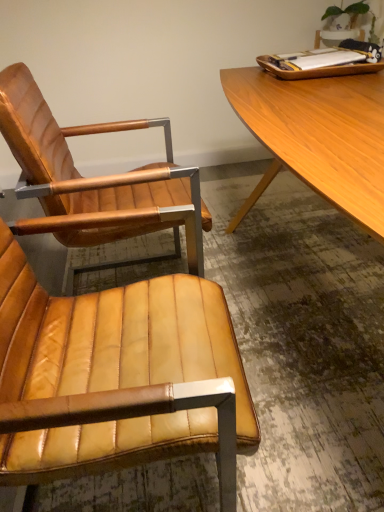
Question: Is the position of leather chair at center, which appears as the second chair when viewed from the front, more distant than that of leather chair at center, which ranks as the first chair in front-to-back order?

Choices:
 (A) yes
 (B) no

Answer: (A)

Question: Is leather chair at center, which appears as the second chair when viewed from the front, smaller than leather chair at center, which appears as the second chair when viewed from the back?

Choices:
 (A) yes
 (B) no

Answer: (B)

Question: Would you say leather chair at center, which ranks as the first chair in front-to-back order, is part of leather chair at center, which appears as the second chair when viewed from the front,'s contents?

Choices:
 (A) yes
 (B) no

Answer: (B)

Question: From the image's perspective, is leather chair at center, which appears as the second chair when viewed from the front, below leather chair at center, which appears as the second chair when viewed from the back?

Choices:
 (A) yes
 (B) no

Answer: (B)

Question: Is leather chair at center, the first chair from the back, outside leather chair at center, which appears as the second chair when viewed from the back?

Choices:
 (A) no
 (B) yes

Answer: (B)

Question: From the image's perspective, is leather chair at center, the first chair from the back, located above leather chair at center, which ranks as the first chair in front-to-back order?

Choices:
 (A) yes
 (B) no

Answer: (A)

Question: From a real-world perspective, is leather chair at center, which appears as the second chair when viewed from the back, located higher than leather chair at center, which appears as the second chair when viewed from the front?

Choices:
 (A) yes
 (B) no

Answer: (B)

Question: From a real-world perspective, is leather chair at center, which appears as the second chair when viewed from the back, positioned under leather chair at center, which appears as the second chair when viewed from the front, based on gravity?

Choices:
 (A) yes
 (B) no

Answer: (A)

Question: Would you say leather chair at center, which ranks as the first chair in front-to-back order, is a long distance from leather chair at center, which appears as the second chair when viewed from the front?

Choices:
 (A) no
 (B) yes

Answer: (A)

Question: Is leather chair at center, which appears as the second chair when viewed from the back, thinner than leather chair at center, the first chair from the back?

Choices:
 (A) yes
 (B) no

Answer: (A)

Question: Is leather chair at center, which ranks as the first chair in front-to-back order, surrounding leather chair at center, the first chair from the back?

Choices:
 (A) yes
 (B) no

Answer: (B)

Question: Is the surface of leather chair at center, which appears as the second chair when viewed from the back, in direct contact with leather chair at center, the first chair from the back?

Choices:
 (A) yes
 (B) no

Answer: (B)

Question: From the image's perspective, relative to leather chair at center, which appears as the second chair when viewed from the front, is leather chair at center, which ranks as the first chair in front-to-back order, above or below?

Choices:
 (A) above
 (B) below

Answer: (B)